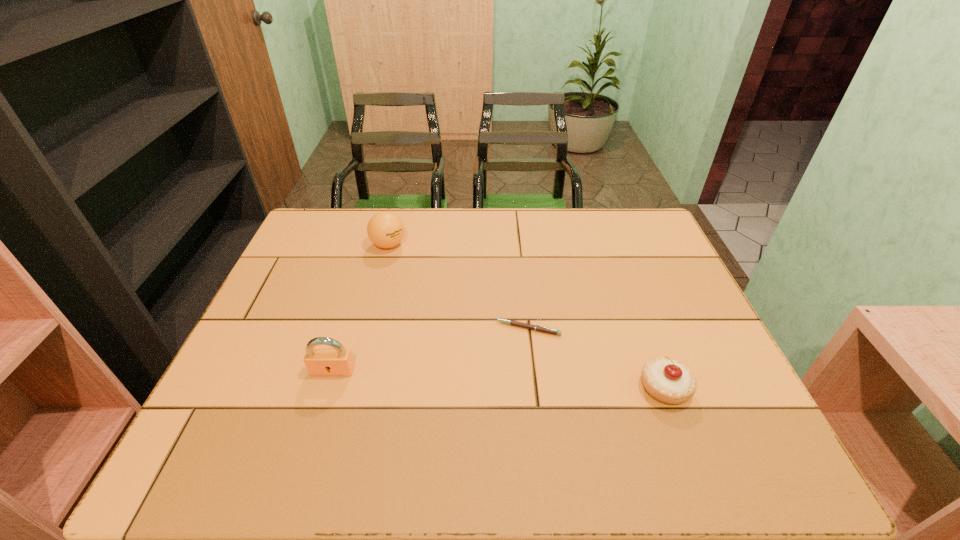
This screenshot has width=960, height=540. In order to click on free spot on the desktop that is between the padlock and the rightmost object and is positioned at the nib of the shortest object in this screenshot , I will do `click(457, 377)`.

At what (x,y) coordinates should I click in order to perform the action: click on free space on the desktop that is between the padlock and the pastry and is positioned on the side with brand of the farthest object. Please return your answer as a coordinate pair (x, y). Looking at the image, I should click on (450, 377).